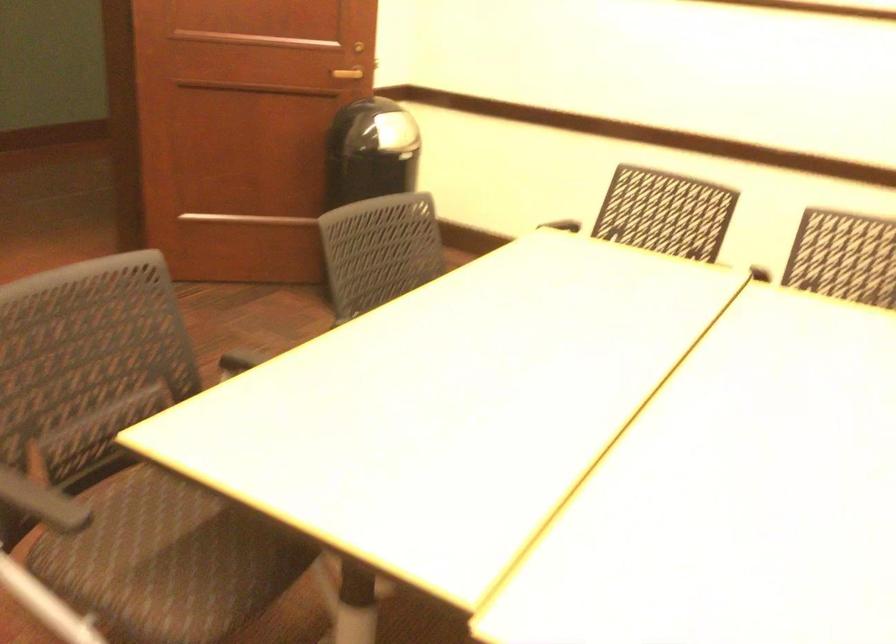
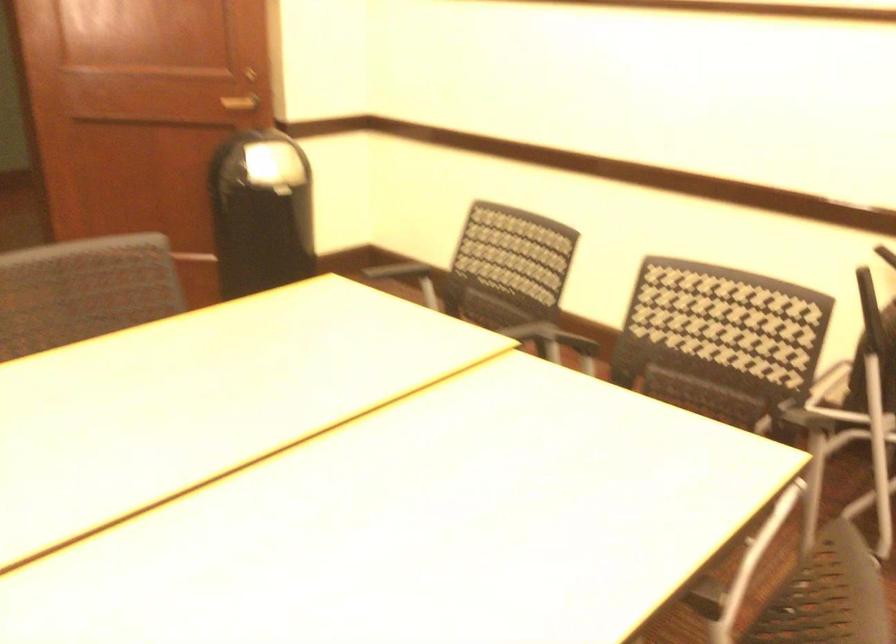
Find the pixel in the second image that matches pixel 367 73 in the first image.

(240, 102)